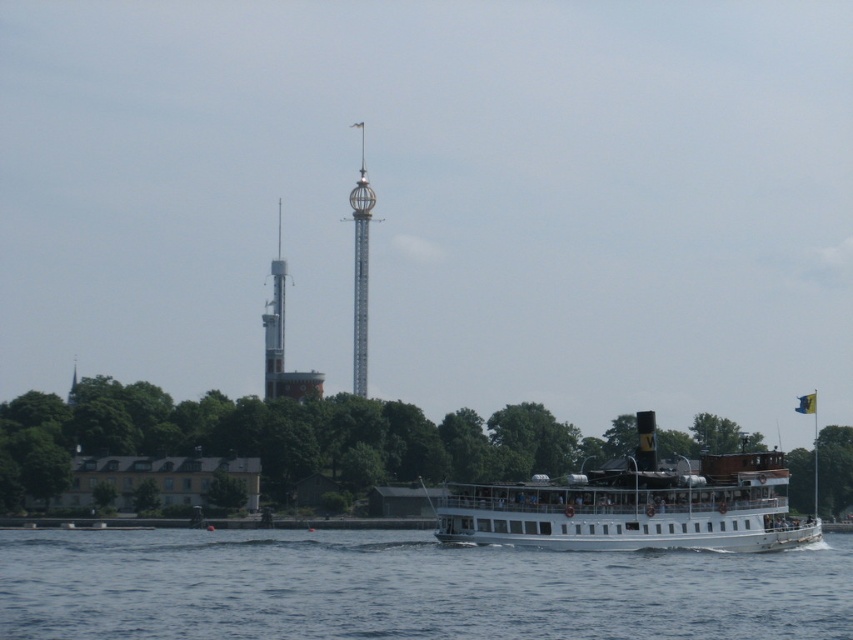
Who is higher up, white matte steamboat at center or white metallic tower at center?

Positioned higher is white metallic tower at center.

Who is shorter, white matte steamboat at center or white metallic tower at center?

Standing shorter between the two is white matte steamboat at center.

At what (x,y) coordinates should I click in order to perform the action: click on white matte steamboat at center. Please return your answer as a coordinate pair (x, y). Looking at the image, I should click on (635, 506).

Does point (270, 376) come farther from viewer compared to point (352, 340)?

No, it is in front of (352, 340).

I want to click on white metallic tower at center, so click(282, 339).

Which of these two, white smooth water at lower center or silver metallic tower at center, stands shorter?

white smooth water at lower center

Does point (614, 582) come farther from viewer compared to point (357, 244)?

No.

This screenshot has width=853, height=640. I want to click on white smooth water at lower center, so click(405, 588).